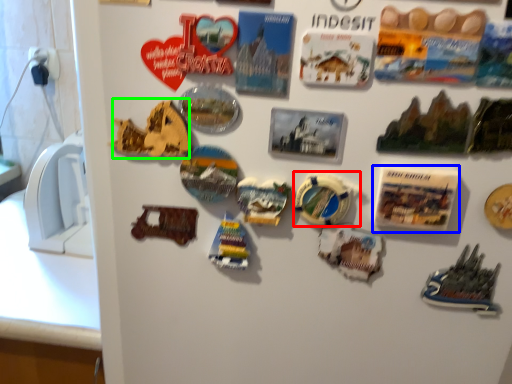
Question: Estimate the real-world distances between objects in this image. Which object is farther from stuff (highlighted by a red box), postcard (highlighted by a blue box) or stuff (highlighted by a green box)?

Choices:
 (A) postcard
 (B) stuff

Answer: (B)